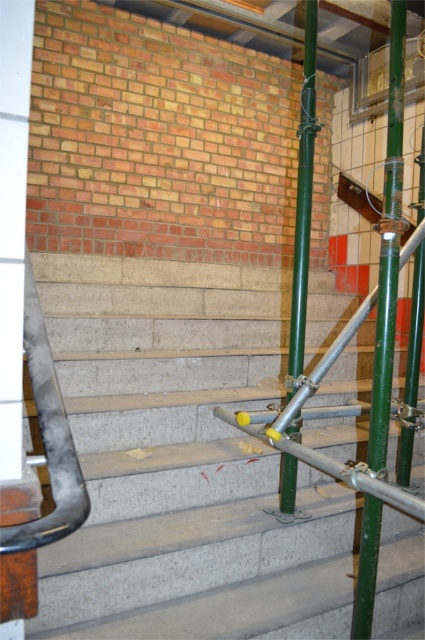
At what (x,y) coordinates should I click in order to perform the action: click on concrete stairs at center. Please return your answer as a coordinate pair (x, y). Image resolution: width=425 pixels, height=640 pixels. Looking at the image, I should click on (184, 460).

What do you see at coordinates (184, 460) in the screenshot?
I see `concrete stairs at center` at bounding box center [184, 460].

Who is more distant from viewer, (x=104, y=561) or (x=391, y=33)?

Positioned behind is point (x=391, y=33).

Find the location of a particular element. The width and height of the screenshot is (425, 640). concrete stairs at center is located at coordinates (184, 460).

Can you confirm if green metallic pole at right is thinner than green metallic pole at center?

Correct, green metallic pole at right's width is less than green metallic pole at center's.

Describe the element at coordinates (388, 248) in the screenshot. The image size is (425, 640). I see `green metallic pole at right` at that location.

Does point (396, 113) come closer to viewer compared to point (288, 365)?

Yes, it is in front of point (288, 365).

Where is `green metallic pole at right`? The width and height of the screenshot is (425, 640). green metallic pole at right is located at coordinates (388, 248).

Is concrete stairs at center in front of green metallic pole at center?

That is True.

Looking at this image, measure the distance between concrete stairs at center and camera.

concrete stairs at center and camera are 4.85 feet apart from each other.

The height and width of the screenshot is (640, 425). Find the location of `concrete stairs at center`. concrete stairs at center is located at coordinates (184, 460).